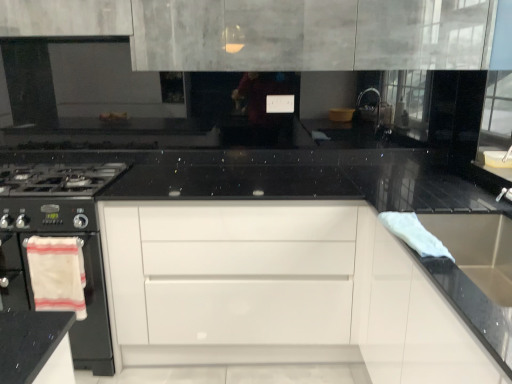
Question: Based on their positions, is white glossy drawer at center located to the left or right of stainless steel sink at right?

Choices:
 (A) right
 (B) left

Answer: (B)

Question: Does point (205, 233) appear closer or farther from the camera than point (505, 292)?

Choices:
 (A) farther
 (B) closer

Answer: (A)

Question: Estimate the real-world distances between objects in this image. Which object is closer to the black matte gas stove at left?

Choices:
 (A) white cotton towel at left, positioned as the first material in left-to-right order
 (B) white glossy drawer at center
 (C) stainless steel sink at right
 (D) white cloth at right, which is the second material from back to front

Answer: (A)

Question: Estimate the real-world distances between objects in this image. Which object is closer to the black matte gas stove at left?

Choices:
 (A) white glossy drawer at center
 (B) white cotton towel at left, which is the second material in right-to-left order
 (C) white cloth at right, the 1th material from the right
 (D) stainless steel sink at right

Answer: (B)